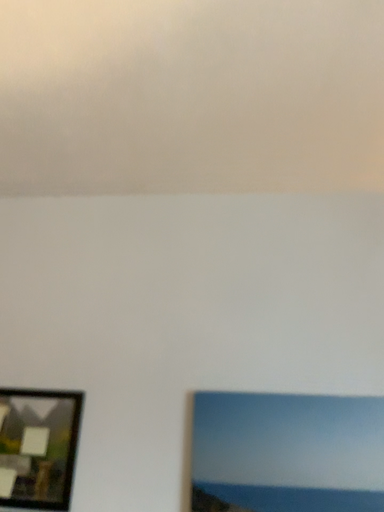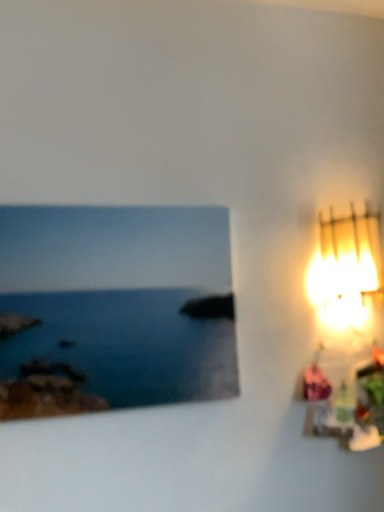
Question: How did the camera likely rotate when shooting the video?

Choices:
 (A) rotated upward
 (B) rotated downward

Answer: (B)